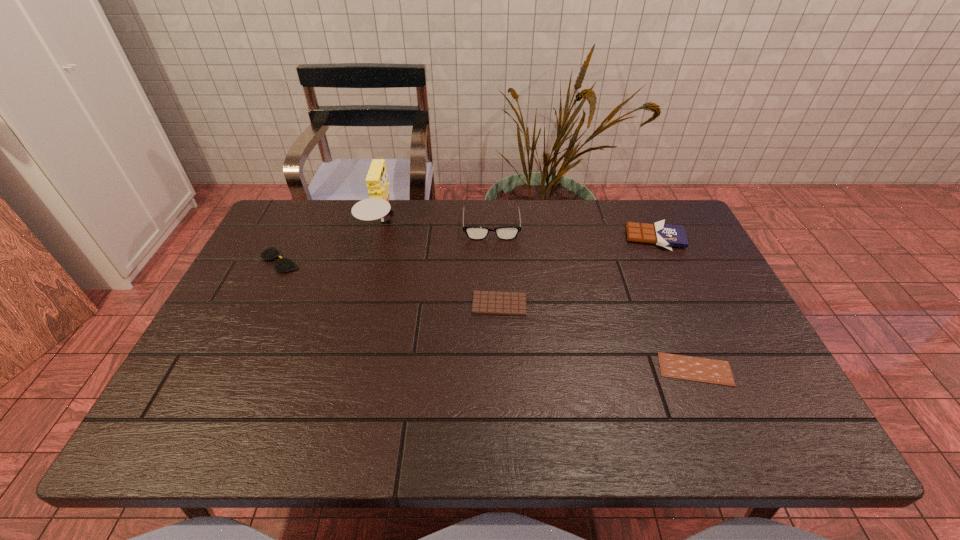
Image resolution: width=960 pixels, height=540 pixels. I want to click on vacant space in between the fifth object from right to left and the second tallest chocolate bar, so click(441, 265).

Find the location of `vacant space that is in between the second farthest chocolate bar and the farthest chocolate bar`. vacant space that is in between the second farthest chocolate bar and the farthest chocolate bar is located at coordinates (577, 271).

Locate an element on the screen. This screenshot has width=960, height=540. free spot between the right spectacles and the shortest object is located at coordinates (593, 298).

Where is `free point between the sponge and the right spectacles`? free point between the sponge and the right spectacles is located at coordinates (437, 226).

The width and height of the screenshot is (960, 540). I want to click on empty space between the nearest object and the leftmost chocolate bar, so click(x=597, y=337).

The height and width of the screenshot is (540, 960). In order to click on free space that is in between the nearest chocolate bar and the farthest chocolate bar in this screenshot , I will do `click(675, 303)`.

Where is `vacant space in between the second object from left to right and the nearest chocolate bar`? This screenshot has height=540, width=960. vacant space in between the second object from left to right and the nearest chocolate bar is located at coordinates [539, 298].

In order to click on the fourth closest object to the second farthest chocolate bar in this screenshot , I will do `click(665, 235)`.

This screenshot has width=960, height=540. I want to click on the second closest object to the sponge, so point(473,232).

Locate which chocolate bar ranks third in proximity to the sponge. Please provide its 2D coordinates. Your answer should be formatted as a tuple, i.e. [(x, y)], where the tuple contains the x and y coordinates of a point satisfying the conditions above.

[(690, 368)]